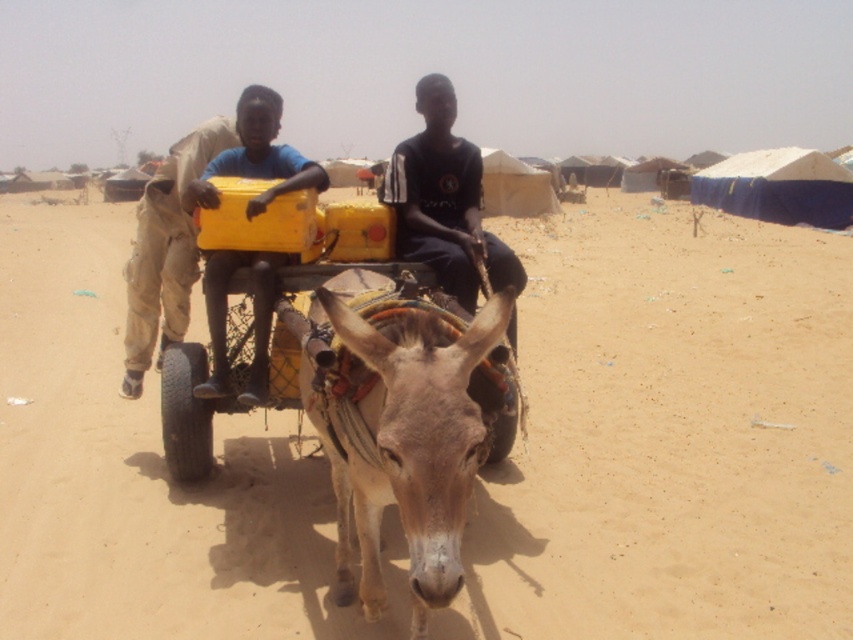
You are a traveler trying to cross the desert. You see the brown sandy ground at center and the light brown fabric pants at left. Which one has a wider area?

The brown sandy ground at center has a larger width than the light brown fabric pants at left.

You are standing in front of the donkey cart scene. There are two points marked on the image. The first point is at coordinate point (479, 228) and the second point is at coordinate point (229, 124). Which point is closer to you?

Point (479, 228) is closer to the viewer than point (229, 124).

You are a traveler in the desert and need to determine which object in the scene is larger. You see the brown sandy ground at center and the light brown fabric pants at left. Which one is larger?

The brown sandy ground at center is bigger than the light brown fabric pants at left, so the brown sandy ground at center is larger.